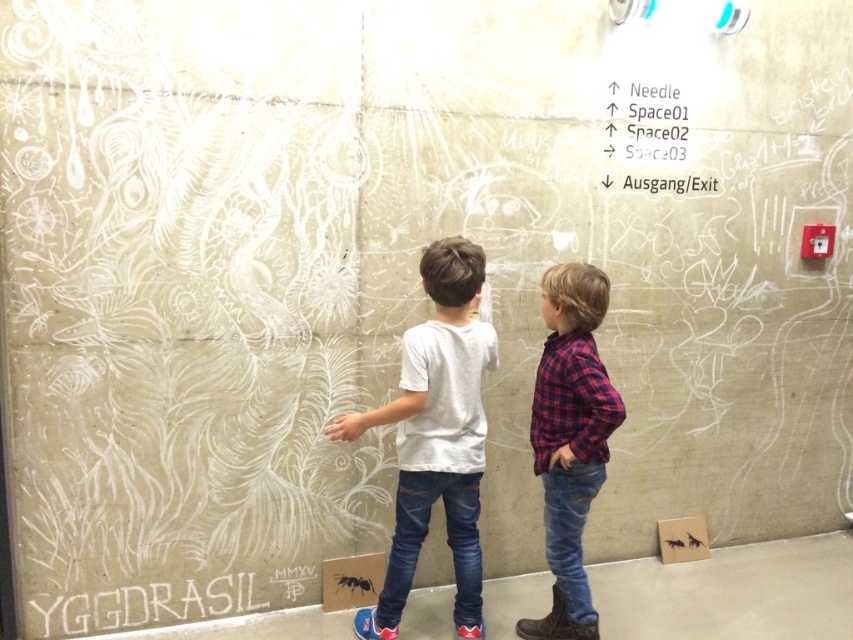
Based on the photo, is plaid fabric shirt at center smaller than white chalk writing at lower left?

Actually, plaid fabric shirt at center might be larger than white chalk writing at lower left.

Locate an element on the screen. Image resolution: width=853 pixels, height=640 pixels. plaid fabric shirt at center is located at coordinates (570, 440).

Identify the location of plaid fabric shirt at center. (570, 440).

Who is higher up, white matte shirt at center or white chalk writing at lower left?

Positioned higher is white matte shirt at center.

Is white matte shirt at center to the right of white chalk writing at lower left from the viewer's perspective?

Yes, white matte shirt at center is to the right of white chalk writing at lower left.

The image size is (853, 640). I want to click on white matte shirt at center, so click(x=436, y=436).

Who is positioned more to the left, white matte shirt at center or white chalk writing at upper center?

Positioned to the left is white matte shirt at center.

In the scene shown: Which is more to the right, white matte shirt at center or white chalk writing at upper center?

From the viewer's perspective, white chalk writing at upper center appears more on the right side.

Measure the distance between point (445, 412) and camera.

Point (445, 412) is 8.42 feet away from camera.

Where is `white matte shirt at center`? Image resolution: width=853 pixels, height=640 pixels. white matte shirt at center is located at coordinates (436, 436).